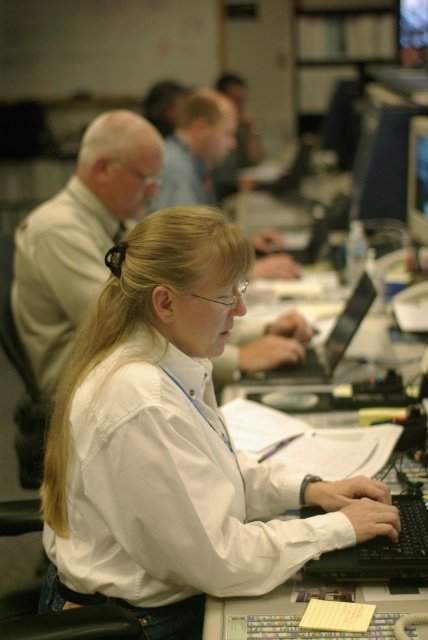
What are the coordinates of the black plastic laptop at center?

The black plastic laptop at center is located at point [329,340].

You are a person sitting in an office. You see a white plastic table at center and a black plastic laptop at center. Which object is closer to you?

The white plastic table at center is closer to you because it is positioned in front of the black plastic laptop at center.